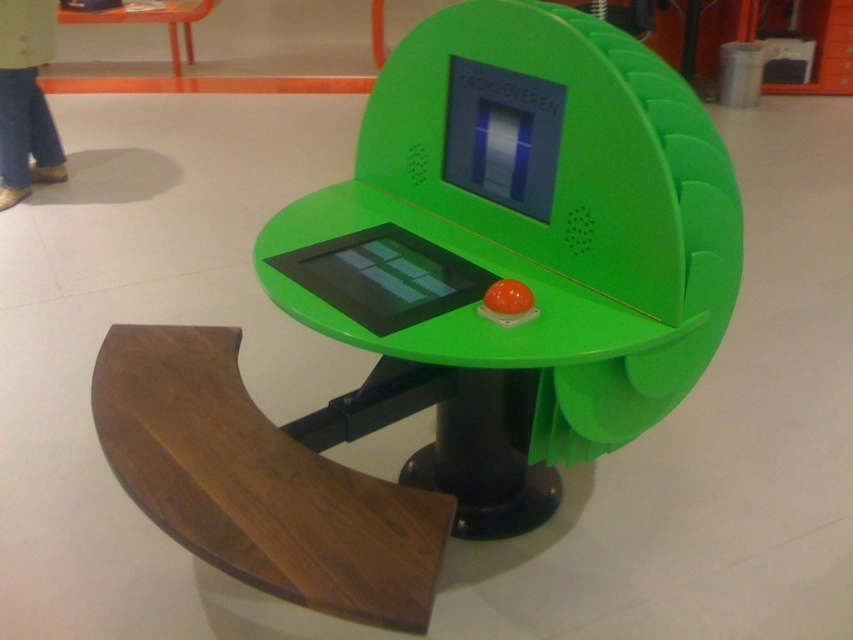
In the scene shown: You are sitting in a room and want to reach both the walnut wood armrest at lower left and the orange glossy table at upper left. Which object will you touch first if you extend your hand forward?

The walnut wood armrest at lower left is closer to the viewer than the orange glossy table at upper left, so you will touch the walnut wood armrest at lower left first.

You are standing in front of the turtle shell gaming setup and notice two points marked on the structure. The first point is at coordinates point (351, 536) and the second is at point (172, 52). Which point is nearer to you?

Point (351, 536) is closer to the viewer than point (172, 52).